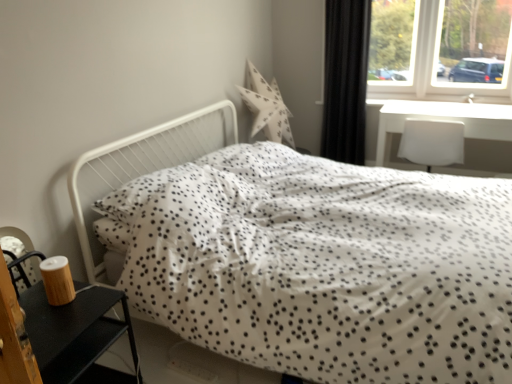
Question: Can you confirm if black fabric curtain at upper right is shorter than white plastic chair at right?

Choices:
 (A) no
 (B) yes

Answer: (A)

Question: Considering the relative sizes of black fabric curtain at upper right and white plastic chair at right in the image provided, is black fabric curtain at upper right taller than white plastic chair at right?

Choices:
 (A) no
 (B) yes

Answer: (B)

Question: Is white plastic chair at right surrounded by black fabric curtain at upper right?

Choices:
 (A) yes
 (B) no

Answer: (B)

Question: Is black fabric curtain at upper right further to the viewer compared to white plastic chair at right?

Choices:
 (A) no
 (B) yes

Answer: (B)

Question: Is black fabric curtain at upper right far from white plastic chair at right?

Choices:
 (A) yes
 (B) no

Answer: (B)

Question: From the image's perspective, is white plastic chair at right above or below wooden nightstand at lower left?

Choices:
 (A) below
 (B) above

Answer: (B)

Question: From a real-world perspective, is white plastic chair at right physically located above or below wooden nightstand at lower left?

Choices:
 (A) below
 (B) above

Answer: (B)

Question: Considering the positions of white plastic chair at right and wooden nightstand at lower left in the image, is white plastic chair at right taller or shorter than wooden nightstand at lower left?

Choices:
 (A) tall
 (B) short

Answer: (B)

Question: Is point (421, 97) positioned closer to the camera than point (99, 380)?

Choices:
 (A) closer
 (B) farther

Answer: (B)

Question: In the image, is white plastic chair at right positioned in front of or behind transparent glass window at upper right?

Choices:
 (A) behind
 (B) front

Answer: (A)

Question: Is white plastic chair at right bigger or smaller than transparent glass window at upper right?

Choices:
 (A) big
 (B) small

Answer: (B)

Question: Considering the relative positions of white plastic chair at right and transparent glass window at upper right in the image provided, is white plastic chair at right to the left or to the right of transparent glass window at upper right?

Choices:
 (A) left
 (B) right

Answer: (A)

Question: Is point (415, 97) positioned closer to the camera than point (414, 66)?

Choices:
 (A) farther
 (B) closer

Answer: (B)

Question: Is black fabric curtain at upper right in front of or behind white plastic chair at right in the image?

Choices:
 (A) front
 (B) behind

Answer: (B)

Question: From a real-world perspective, is black fabric curtain at upper right positioned above or below white plastic chair at right?

Choices:
 (A) above
 (B) below

Answer: (A)